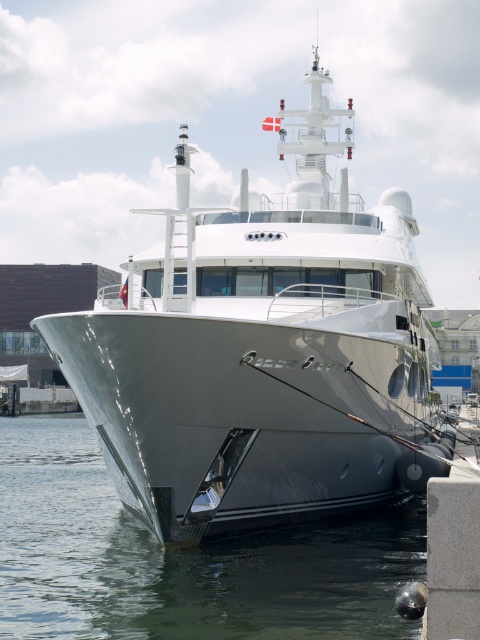
You are a dock worker assessing the positioning of the yacht. Based on the scene, which object is closer to you between the sleek metallic yacht at center and the clear water at hull front?

The sleek metallic yacht at center is closer to you than the clear water at hull front because it is positioned further to the viewer in the scene.

You are a dock worker checking the yacht. Based on the scene, is the sleek metallic yacht at center positioned higher or lower than the clear water at hull front?

The sleek metallic yacht at center is above the clear water at hull front, so it is positioned higher than the clear water at hull front.